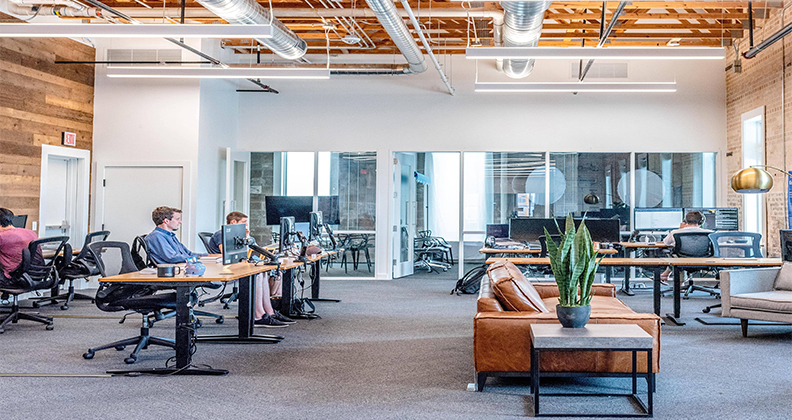
Where is `lamp`? The image size is (792, 420). lamp is located at coordinates (751, 181), (588, 196).